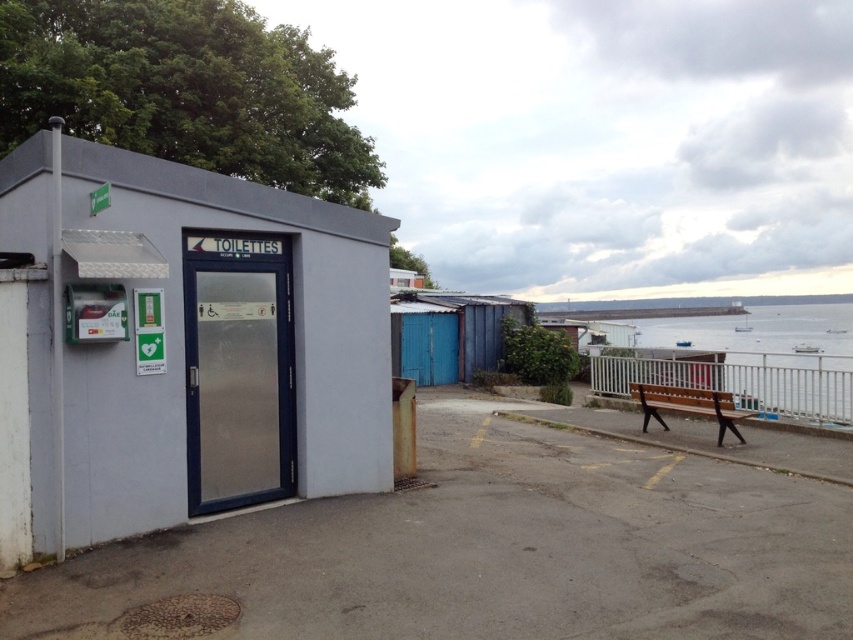
Question: Does white matte toilettes at left come behind blue corrugated metal shed at center?

Choices:
 (A) no
 (B) yes

Answer: (A)

Question: Which point appears closest to the camera in this image?

Choices:
 (A) (32, 182)
 (B) (474, 308)
 (C) (718, 435)
 (D) (680, 344)

Answer: (A)

Question: Which object is closer to the camera taking this photo?

Choices:
 (A) white matte toilettes at left
 (B) blue corrugated metal shed at center
 (C) wooden bench at lower right

Answer: (A)

Question: Which of these objects is positioned closest to the wooden bench at lower right?

Choices:
 (A) blue corrugated metal shed at center
 (B) white matte toilettes at left
 (C) clear water at bench right

Answer: (B)

Question: From the image, what is the correct spatial relationship of white matte toilettes at left in relation to clear water at bench right?

Choices:
 (A) above
 (B) below

Answer: (A)

Question: Can you confirm if white matte toilettes at left is positioned below clear water at bench right?

Choices:
 (A) no
 (B) yes

Answer: (A)